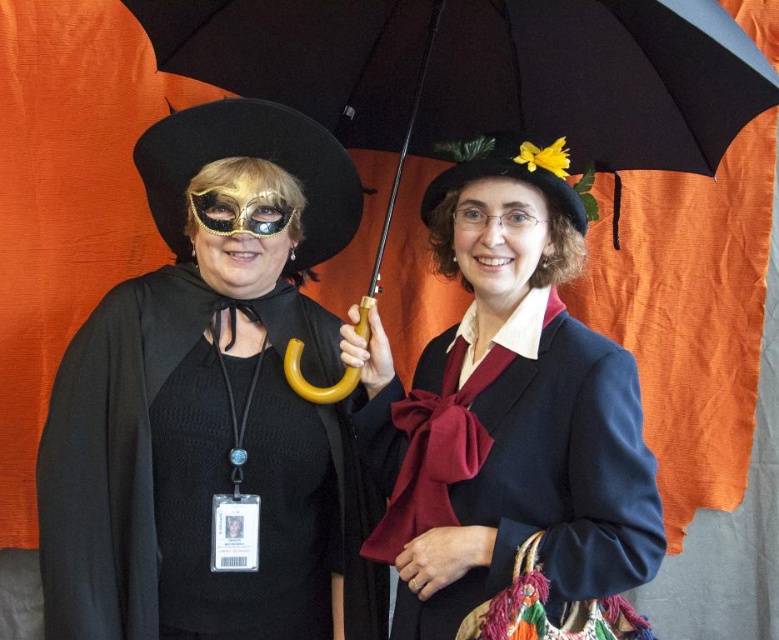
You are a photographer at the event and want to capture a clear photo of the matte black coat at center without any shadows. Since the black matte umbrella at center is casting a shadow, where should you position the light source relative to the umbrella to ensure the shadow falls away from the coat?

The matte black coat at center is positioned under the black matte umbrella at center. To prevent the shadow from the umbrella from falling on the coat, the light source should be placed above the umbrella so the shadow is cast downward away from the coat.

You are a photographer at a costume party and need to position the two main characters so that their costumes fit within a 1.5 meter wide frame. The matte black coat at center and the black matte cape at left must both be fully visible. Given their widths, can both fit side by side within the frame?

The matte black coat at center is wider than the black matte cape at left. Since the total width of both would exceed 1.5 meters, they cannot fit side by side within the frame.

You are a photographer at a costume event. You need to position the matte black coat at center and the black matte cape at left in a way that both are visible in the frame. Given their heights, which object should be placed closer to the front to ensure both are fully visible?

The matte black coat at center is taller than the black matte cape at left, so to ensure both are fully visible, the black matte cape at left should be placed closer to the front.